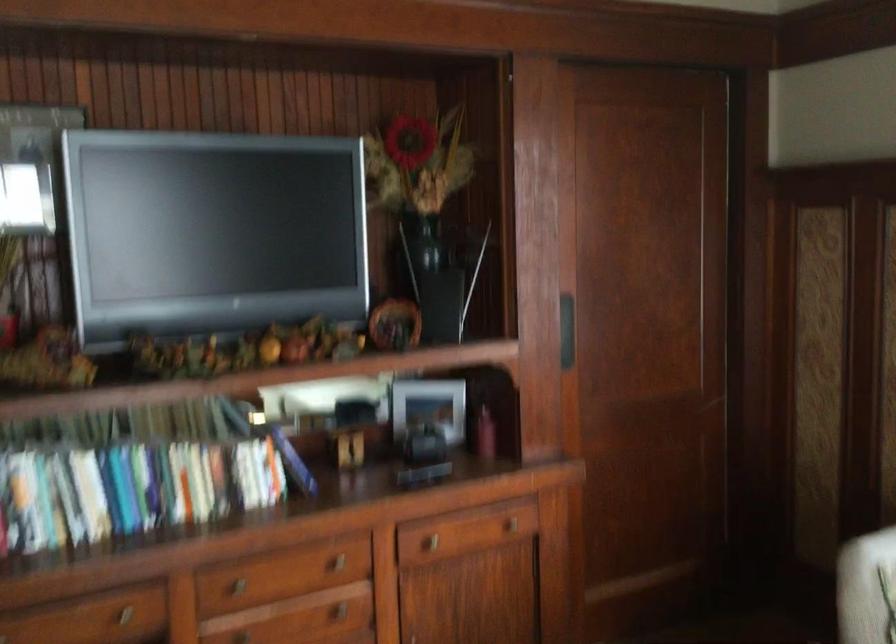
Based on the photo, based on the continuous images, in which direction is the camera rotating?

The camera's rotation is toward right-up.